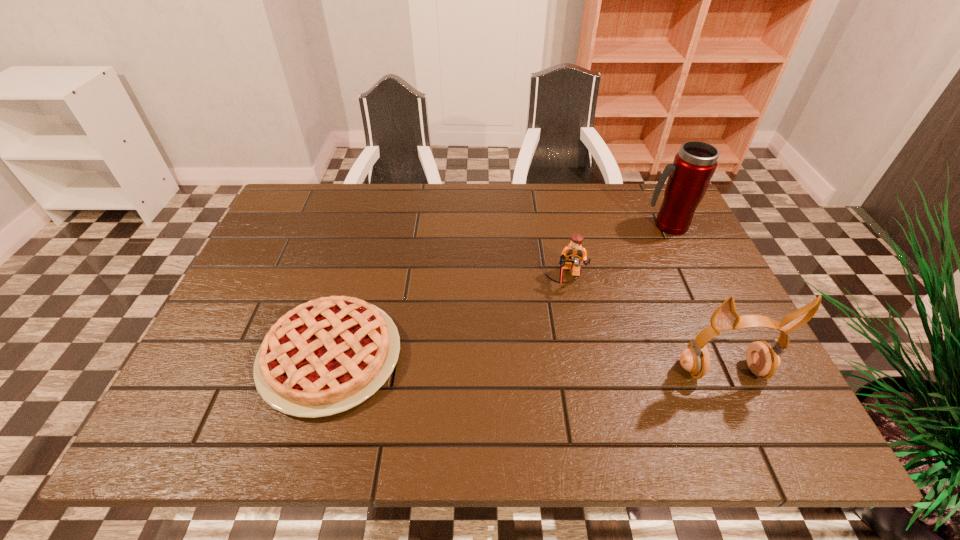
Image resolution: width=960 pixels, height=540 pixels. I want to click on vacant space located 0.140m on the side with the handle of the thermos bottle, so click(x=626, y=256).

You are a GUI agent. You are given a task and a screenshot of the screen. Output one action in this format:
    pyautogui.click(x=<x>, y=<y>)
    Task: Click on the free location located on the side with the handle of the thermos bottle
    The image size is (960, 540).
    Given the screenshot: What is the action you would take?
    pyautogui.click(x=575, y=299)

I want to click on vacant point located 0.240m on the side with the handle of the thermos bottle, so click(x=604, y=275).

Locate an element on the screen. The width and height of the screenshot is (960, 540). object that is at the far edge is located at coordinates (689, 176).

Where is `pie present at the near edge`? This screenshot has width=960, height=540. pie present at the near edge is located at coordinates (328, 355).

This screenshot has height=540, width=960. I want to click on earphone positioned at the near edge, so click(x=762, y=359).

Find the location of `object that is positioned at the left edge`. object that is positioned at the left edge is located at coordinates (328, 355).

In order to click on earphone present at the right edge in this screenshot , I will do `click(762, 359)`.

Where is `thermos bottle situated at the right edge`? The height and width of the screenshot is (540, 960). thermos bottle situated at the right edge is located at coordinates point(689,176).

The image size is (960, 540). I want to click on object positioned at the near left corner, so click(x=328, y=355).